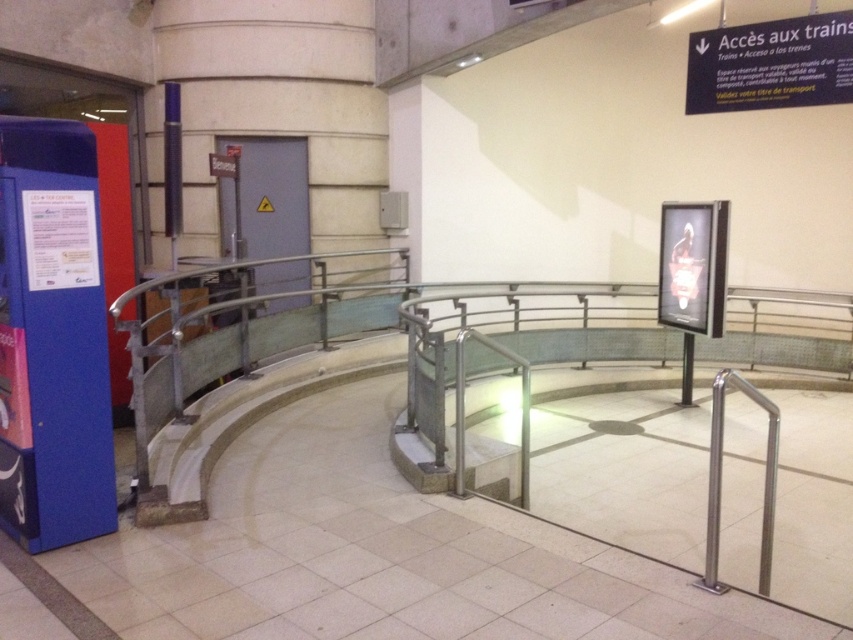
How far apart are blue plastic vending machine at left and white plastic sign at upper right?

blue plastic vending machine at left is 5.58 meters away from white plastic sign at upper right.

Is blue plastic vending machine at left to the right of white plastic sign at upper right from the viewer's perspective?

In fact, blue plastic vending machine at left is to the left of white plastic sign at upper right.

Is point (25, 508) closer to viewer compared to point (694, 84)?

Yes, point (25, 508) is in front of point (694, 84).

Find the location of a particular element. blue plastic vending machine at left is located at coordinates (51, 337).